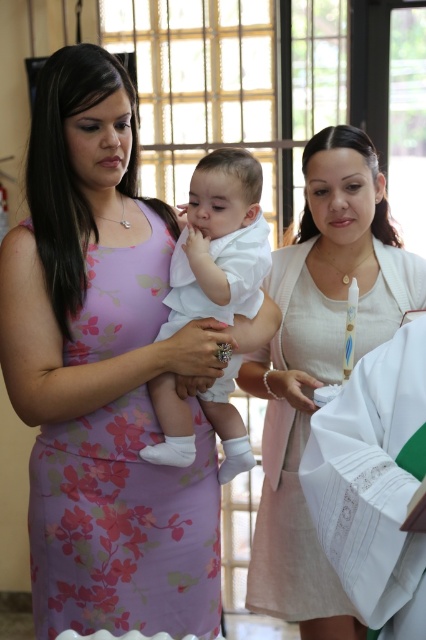
Question: Is white textured dress at center bigger than white cotton baby at center?

Choices:
 (A) no
 (B) yes

Answer: (B)

Question: Based on their relative distances, which object is farther from the white textured dress at center?

Choices:
 (A) floral printed dress at center
 (B) white cotton baby at center

Answer: (A)

Question: Considering the real-world distances, which object is farthest from the white textured dress at center?

Choices:
 (A) floral printed dress at center
 (B) white cotton baby at center

Answer: (A)

Question: Does white textured dress at center have a lesser width compared to white cotton baby at center?

Choices:
 (A) no
 (B) yes

Answer: (A)

Question: Which point is closer to the camera?

Choices:
 (A) floral printed dress at center
 (B) white textured dress at center

Answer: (A)

Question: Considering the relative positions of floral printed dress at center and white cotton baby at center in the image provided, where is floral printed dress at center located with respect to white cotton baby at center?

Choices:
 (A) right
 (B) left

Answer: (B)